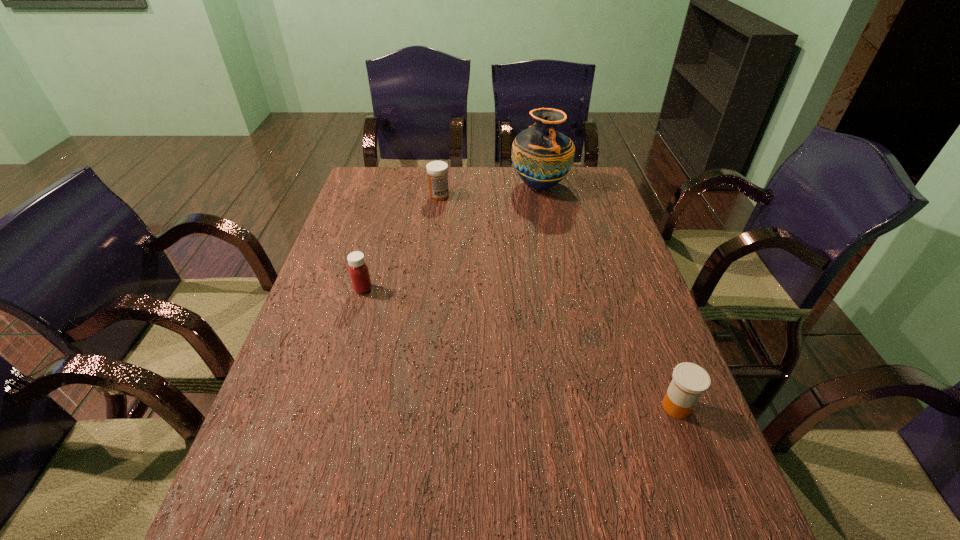
Find the location of a particular element. the tallest object is located at coordinates (542, 156).

Identify the location of the second object from right to left. This screenshot has height=540, width=960. [542, 156].

Where is `the second object from left to right`? The width and height of the screenshot is (960, 540). the second object from left to right is located at coordinates (437, 171).

At what (x,y) coordinates should I click in order to perform the action: click on the farthest medicine. Please return your answer as a coordinate pair (x, y). The height and width of the screenshot is (540, 960). Looking at the image, I should click on (437, 171).

Where is `the second nearest object`? the second nearest object is located at coordinates (358, 269).

Find the location of a particular element. the leftmost medicine is located at coordinates (358, 269).

The image size is (960, 540). Find the location of `the rightmost medicine`. the rightmost medicine is located at coordinates (689, 381).

Where is `the nearest medicine`? the nearest medicine is located at coordinates click(689, 381).

Identify the location of vacant point located on the front of the second object from right to left. This screenshot has height=540, width=960. (544, 210).

Where is `vacant space located 0.310m on the right of the farthest medicine`? This screenshot has height=540, width=960. vacant space located 0.310m on the right of the farthest medicine is located at coordinates (538, 196).